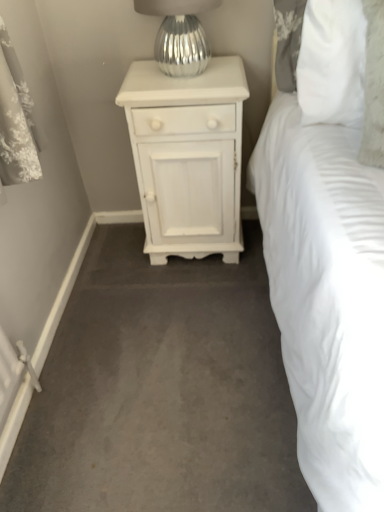
Locate an element on the screen. The image size is (384, 512). vacant space in front of white painted wood nightstand at center is located at coordinates coord(192,303).